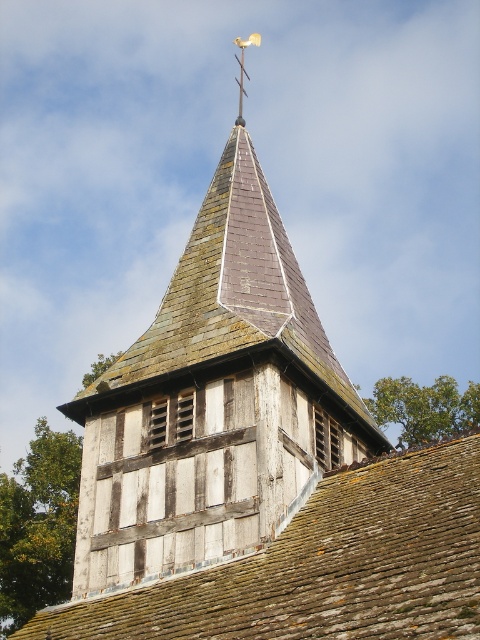
Question: Which of the following is the farthest from the observer?

Choices:
 (A) metallic weather vane at upper center
 (B) weathered wood steeple at center

Answer: (A)

Question: Does weathered brown shingles at center have a greater width compared to metallic weather vane at upper center?

Choices:
 (A) no
 (B) yes

Answer: (B)

Question: Among these objects, which one is nearest to the camera?

Choices:
 (A) weathered wood steeple at center
 (B) weathered brown shingles at center
 (C) metallic weather vane at upper center

Answer: (B)

Question: Is weathered wood steeple at center wider than metallic weather vane at upper center?

Choices:
 (A) yes
 (B) no

Answer: (A)

Question: Is weathered wood steeple at center bigger than weathered brown shingles at center?

Choices:
 (A) yes
 (B) no

Answer: (A)

Question: Which point is closer to the camera?

Choices:
 (A) (241, 48)
 (B) (305, 326)
 (C) (396, 618)

Answer: (C)